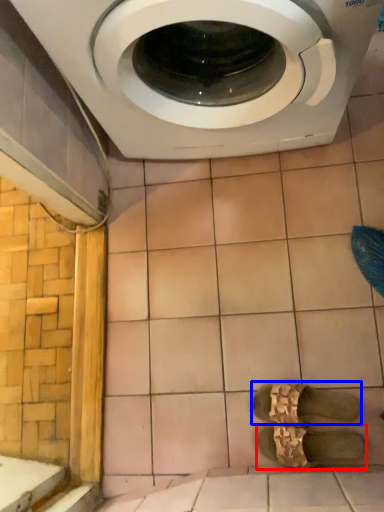
Question: Which of the following is the farthest to the observer, shoe (highlighted by a red box) or shoe (highlighted by a blue box)?

Choices:
 (A) shoe
 (B) shoe

Answer: (B)